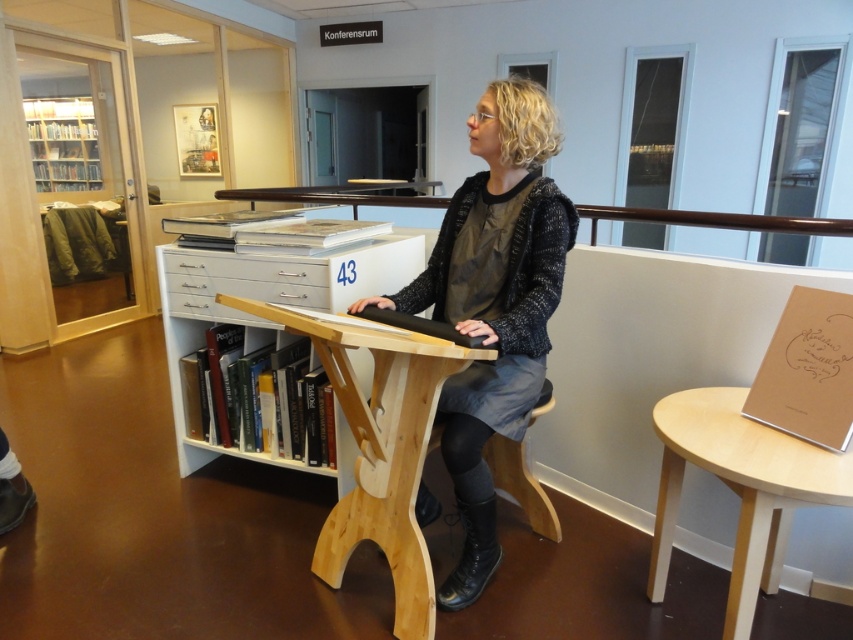
The image size is (853, 640). I want to click on matte black sweater at center, so click(x=492, y=304).

Who is positioned more to the left, matte black sweater at center or white wood file cabinet at center?

From the viewer's perspective, white wood file cabinet at center appears more on the left side.

Where is `matte black sweater at center`? matte black sweater at center is located at coordinates 492,304.

Identify the location of matte black sweater at center. This screenshot has width=853, height=640. (492, 304).

Can you confirm if matte black sweater at center is positioned above white glossy drawer at center?

No, matte black sweater at center is not above white glossy drawer at center.

Is point (426, 493) less distant than point (222, 282)?

That is True.

Image resolution: width=853 pixels, height=640 pixels. What are the coordinates of `matte black sweater at center` in the screenshot? It's located at (492, 304).

Measure the distance between point (x=51, y=106) and camera.

Point (x=51, y=106) is 23.55 feet away from camera.

Which is behind, point (33, 136) or point (538, 532)?

The point (33, 136) is behind.

Is point (65, 188) more distant than point (541, 524)?

That is True.

At what (x,y) coordinates should I click in order to perform the action: click on wooden bookshelf at upper left. Please return your answer as a coordinate pair (x, y). The image size is (853, 640). Looking at the image, I should click on (62, 144).